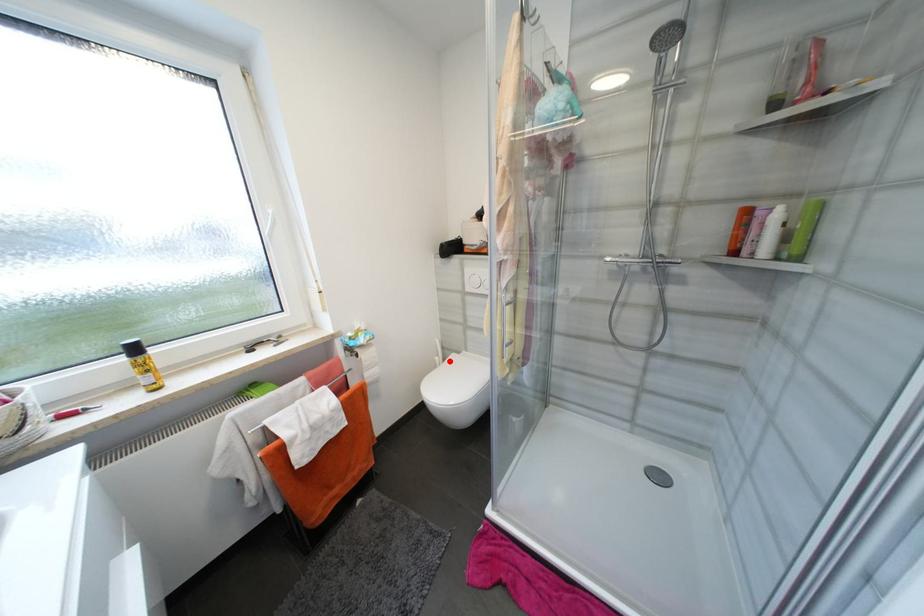
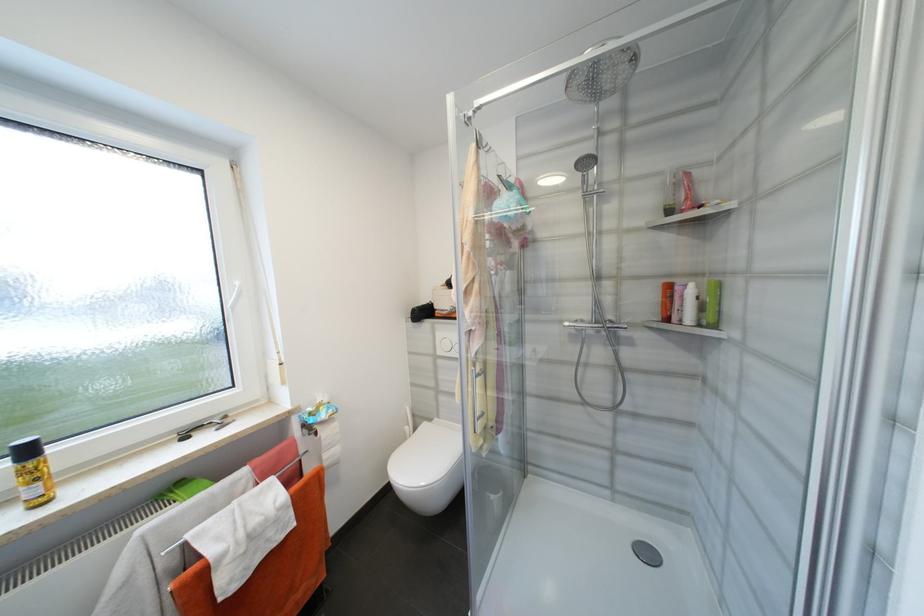
Find the pixel in the second image that matches the highlighted location in the first image.

(420, 431)